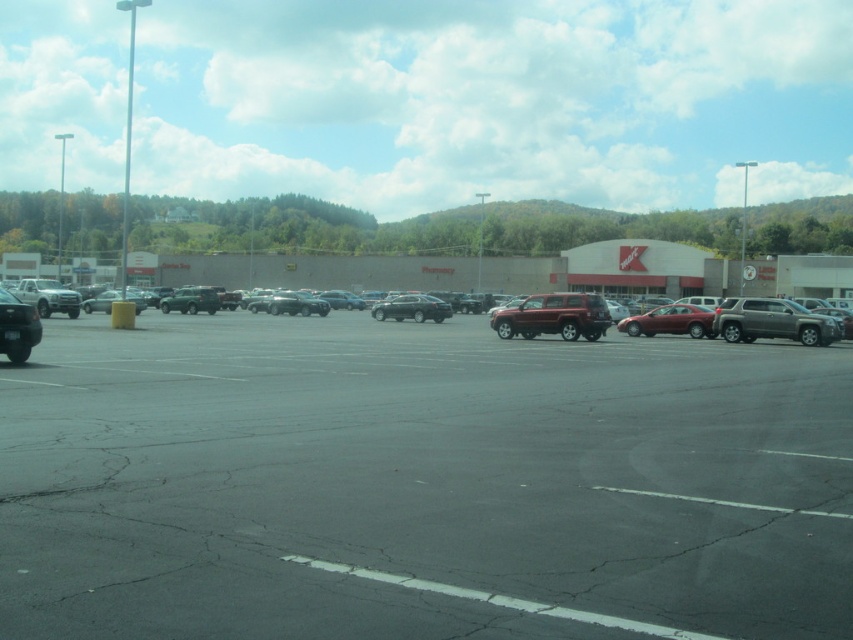
You are standing at the entrance of the Kmart store and want to walk to the parking spot closest to the point labeled point (166, 362). However, there is an obstacle at point labeled point (724, 300). Which point should you avoid walking through?

You should avoid walking through point (724, 300) because it is behind point (166, 362), which is your destination. Since point (166, 362) is in front of point (724, 300), the obstacle at point (724, 300) is further away from your starting position and you can navigate around it to reach your destination.

You are a delivery driver who needs to park your truck between the satin red sedan at center and the shiny black sedan at left. Considering their sizes, which sedan should you position your truck closer to?

The satin red sedan at center is larger than the shiny black sedan at left, so you should position your truck closer to the shiny black sedan at left to ensure enough space between the two sedans.